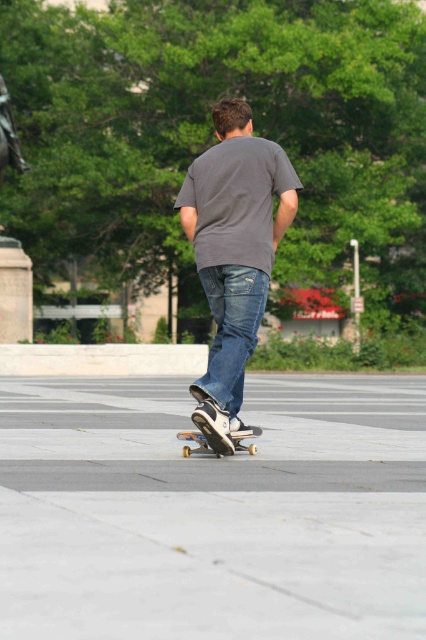
You are a photographer trying to capture the skateboarder. Since the denim jeans at center and wooden skateboard at center are both in focus, can you determine which one is closer to the camera based on their positions?

The denim jeans at center is located above the wooden skateboard at center, so the denim jeans at center is closer to the camera since it is positioned higher in the frame.

You are standing at the point labeled as point [201,458] in the image. You want to throw a frisbee to a friend who is standing where you are currently located. If you can throw the frisbee 30 feet, will it reach your friend?

The distance between point [201,458] and the viewer is 26.84 feet. Since the frisbee can travel 30 feet, which is farther than the required distance, the frisbee will reach your friend.

You are standing at the statue in the background and want to watch the skateboarder. Which point, point (267,285) or point (206,445), is closer to you?

Point (206,445) is closer to you because it is behind point (267,285).